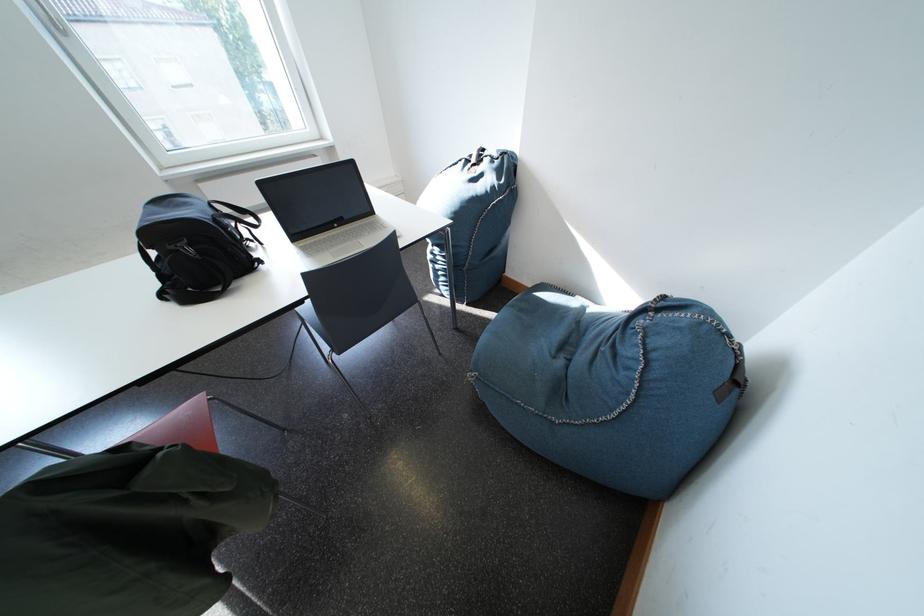
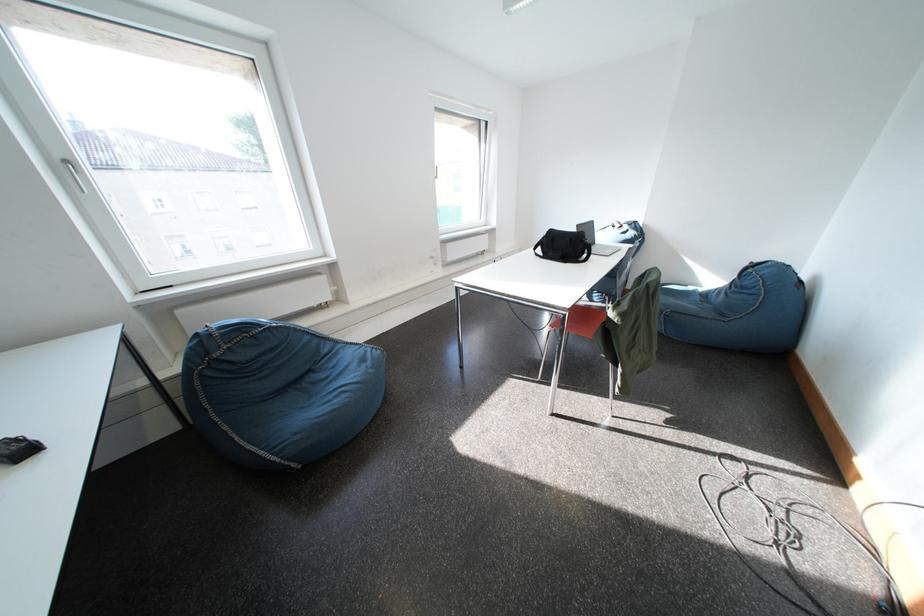
In a continuous first-person perspective shot, in which direction is the camera moving?

The cameraman moved toward left, backward.